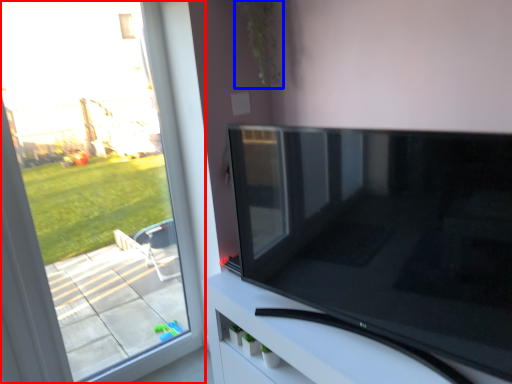
Question: Which of the following is the farthest to the observer, window (highlighted by a red box) or plant (highlighted by a blue box)?

Choices:
 (A) window
 (B) plant

Answer: (B)